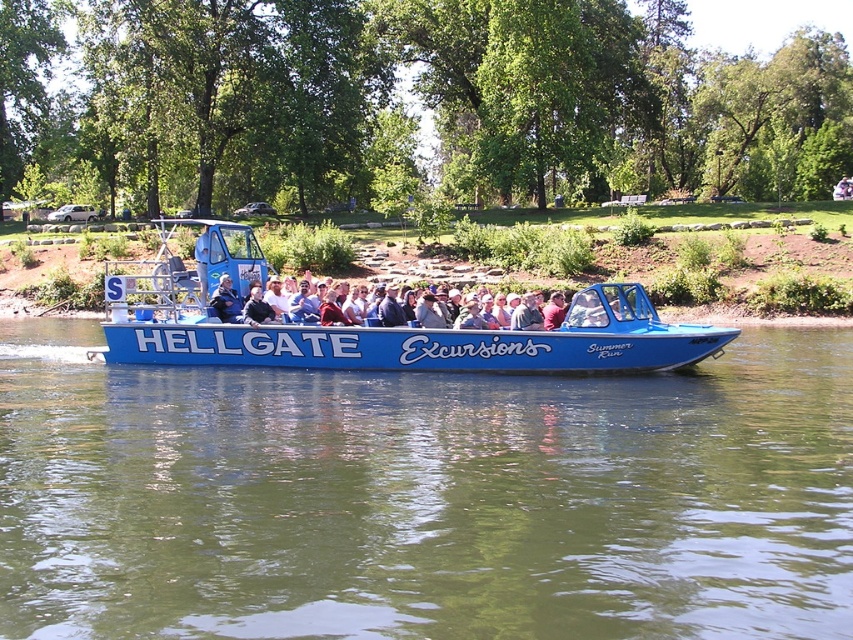
Question: Is green smooth water at center positioned at the back of matte black jacket at center?

Choices:
 (A) yes
 (B) no

Answer: (B)

Question: Which point is closer to the camera taking this photo?

Choices:
 (A) (155, 316)
 (B) (480, 509)

Answer: (B)

Question: Which point is farther to the camera?

Choices:
 (A) (207, 256)
 (B) (490, 541)

Answer: (A)

Question: Is green smooth water at center to the right of matte black jacket at center from the viewer's perspective?

Choices:
 (A) no
 (B) yes

Answer: (B)

Question: Is green smooth water at center to the left of blue plastic boat at center from the viewer's perspective?

Choices:
 (A) no
 (B) yes

Answer: (A)

Question: Which of the following is the closest to the observer?

Choices:
 (A) (227, 284)
 (B) (691, 337)

Answer: (B)